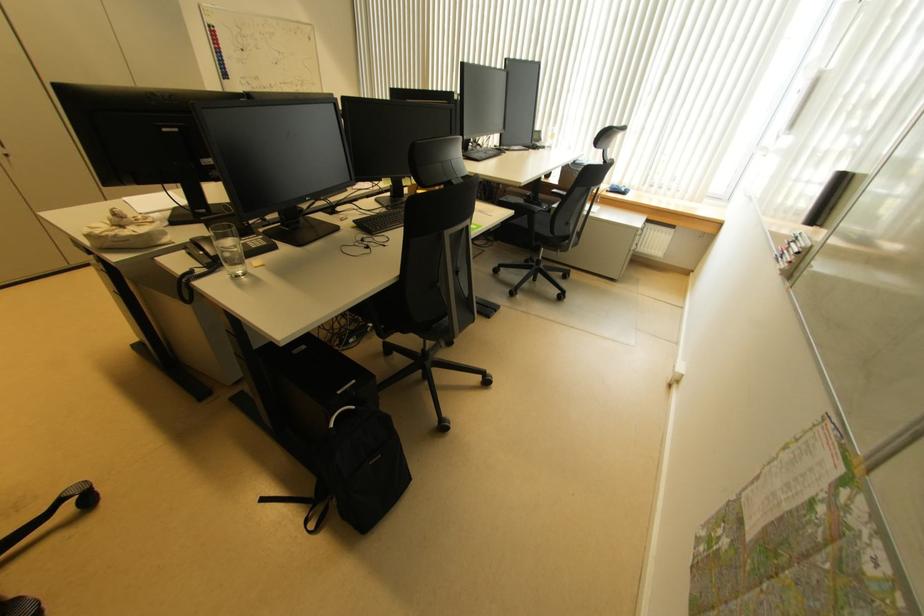
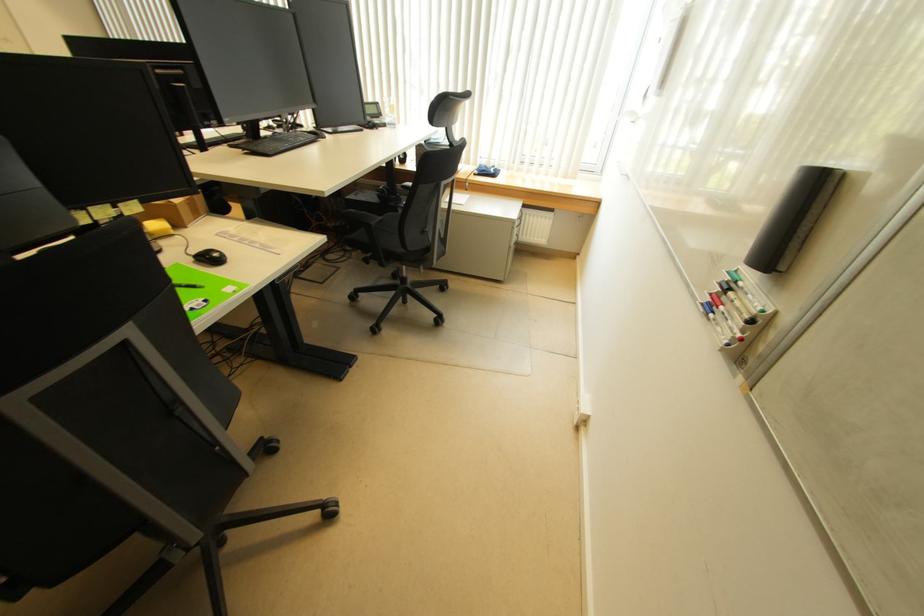
The point at (821, 227) is marked in the first image. Where is the corresponding point in the second image?

(784, 272)